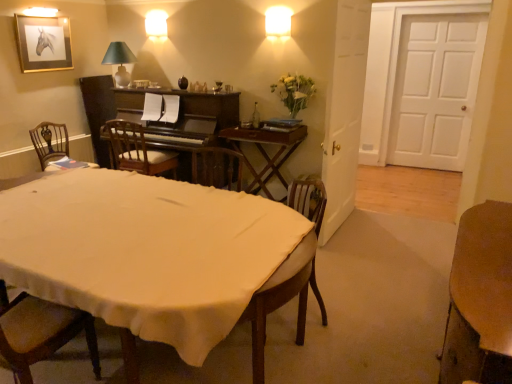
Question: Is green fabric lampshade at upper left, marked as the first lamp in a left-to-right arrangement, shorter than dark brown polished wood piano at center?

Choices:
 (A) yes
 (B) no

Answer: (A)

Question: Is green fabric lampshade at upper left, placed as the 2th lamp when sorted from top to bottom, directly adjacent to dark brown polished wood piano at center?

Choices:
 (A) no
 (B) yes

Answer: (A)

Question: From a real-world perspective, is green fabric lampshade at upper left, marked as the first lamp in a left-to-right arrangement, physically above dark brown polished wood piano at center?

Choices:
 (A) yes
 (B) no

Answer: (A)

Question: Does green fabric lampshade at upper left, marked as the 2th lamp in a right-to-left arrangement, come behind dark brown polished wood piano at center?

Choices:
 (A) no
 (B) yes

Answer: (B)

Question: From the image's perspective, is green fabric lampshade at upper left, positioned as the first lamp in bottom-to-top order, on dark brown polished wood piano at center?

Choices:
 (A) yes
 (B) no

Answer: (A)

Question: Is wooden desk at center, positioned as the second table in front-to-back order, inside the boundaries of gold-framed picture at upper left, or outside?

Choices:
 (A) outside
 (B) inside

Answer: (A)

Question: Looking at their shapes, would you say wooden desk at center, acting as the 2th table starting from the bottom, is wider or thinner than gold-framed picture at upper left?

Choices:
 (A) wide
 (B) thin

Answer: (A)

Question: In the image, is wooden desk at center, arranged as the first table when viewed from the left, positioned in front of or behind gold-framed picture at upper left?

Choices:
 (A) behind
 (B) front

Answer: (B)

Question: Does point [252, 175] appear closer or farther from the camera than point [51, 51]?

Choices:
 (A) farther
 (B) closer

Answer: (A)

Question: Considering the positions of transparent glass bottle at center and green fabric lampshade at upper left, marked as the 2th lamp in a right-to-left arrangement, in the image, is transparent glass bottle at center taller or shorter than green fabric lampshade at upper left, marked as the 2th lamp in a right-to-left arrangement,?

Choices:
 (A) short
 (B) tall

Answer: (A)

Question: Relative to green fabric lampshade at upper left, marked as the first lamp in a left-to-right arrangement, is transparent glass bottle at center in front or behind?

Choices:
 (A) front
 (B) behind

Answer: (A)

Question: From a real-world perspective, relative to green fabric lampshade at upper left, positioned as the first lamp in bottom-to-top order, is transparent glass bottle at center vertically above or below?

Choices:
 (A) above
 (B) below

Answer: (B)

Question: Considering the positions of transparent glass bottle at center and green fabric lampshade at upper left, marked as the first lamp in a left-to-right arrangement, in the image, is transparent glass bottle at center wider or thinner than green fabric lampshade at upper left, marked as the first lamp in a left-to-right arrangement,?

Choices:
 (A) wide
 (B) thin

Answer: (B)

Question: Considering the positions of point (226, 135) and point (254, 117), is point (226, 135) closer or farther from the camera than point (254, 117)?

Choices:
 (A) farther
 (B) closer

Answer: (B)

Question: Considering the positions of wooden desk at center, arranged as the first table when viewed from the left, and transparent glass bottle at center in the image, is wooden desk at center, arranged as the first table when viewed from the left, bigger or smaller than transparent glass bottle at center?

Choices:
 (A) big
 (B) small

Answer: (A)